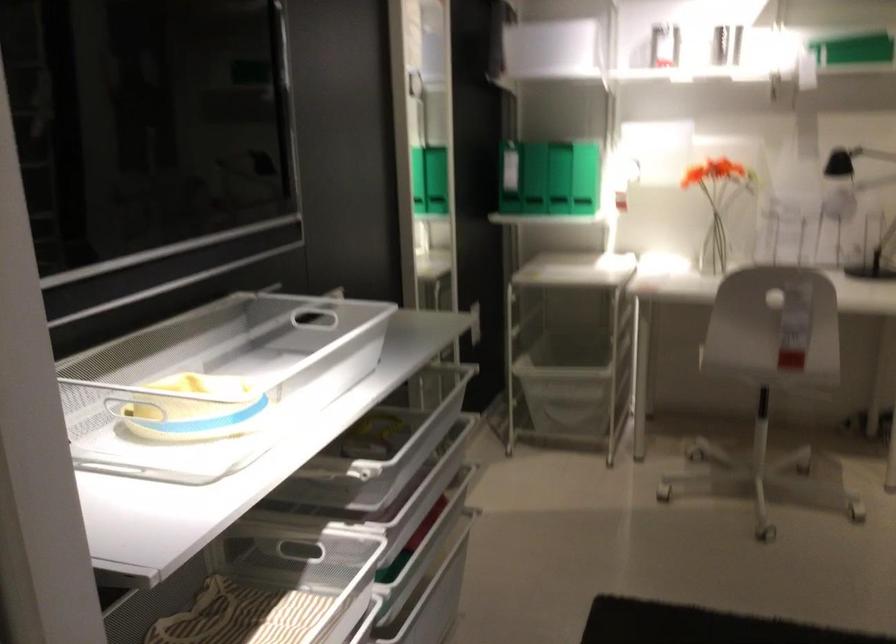
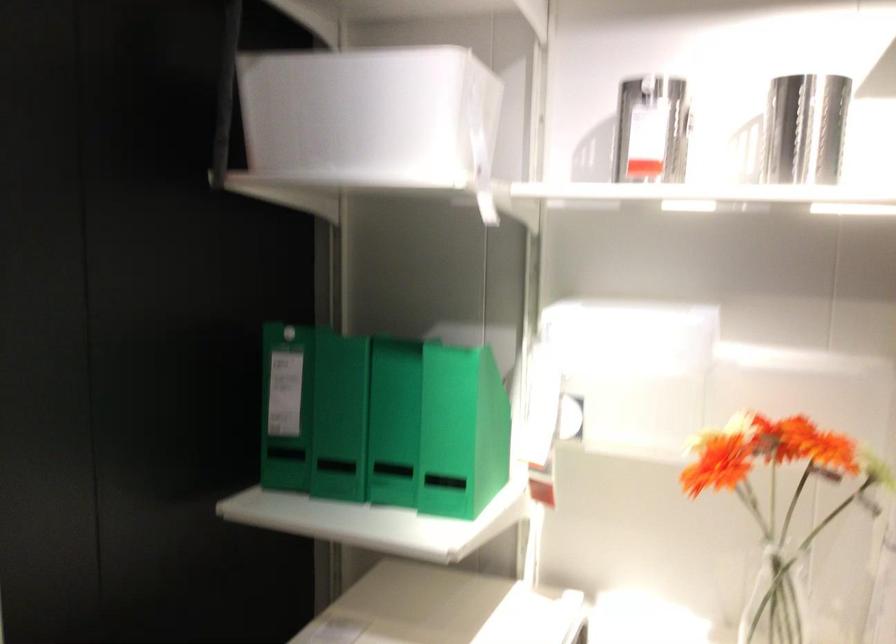
Find the pixel in the second image that matches point (727, 216) in the first image.

(777, 600)